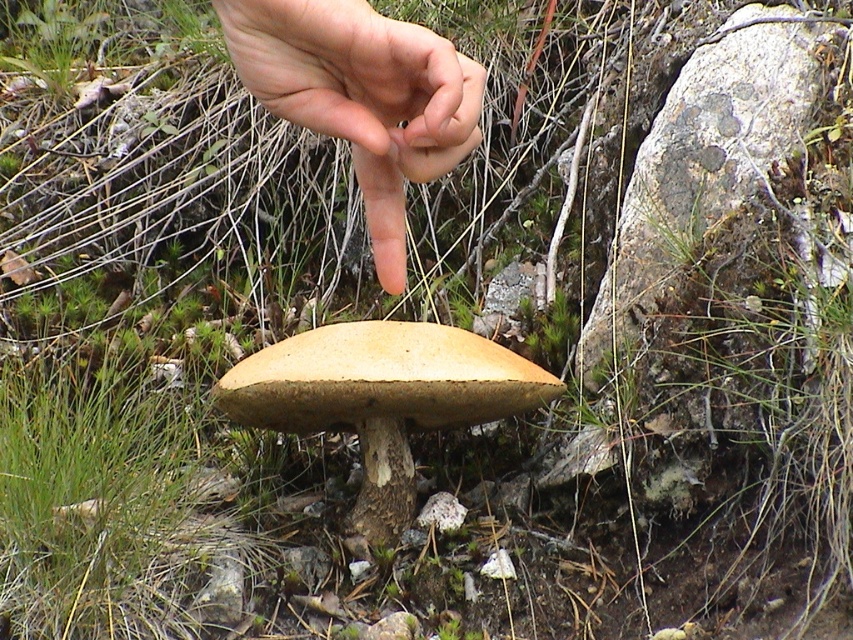
Which of these two, skinny flesh at center or light brown wood at center, stands taller?

With more height is light brown wood at center.

Is point (296, 8) closer to camera compared to point (318, 378)?

That is True.

Where is `skinny flesh at center`? The width and height of the screenshot is (853, 640). skinny flesh at center is located at coordinates (361, 97).